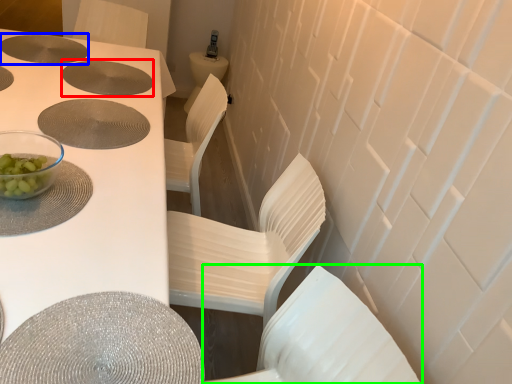
Question: Which object is positioned farthest from hole (highlighted by a red box)? Select from hole (highlighted by a blue box) and chair (highlighted by a green box).

Choices:
 (A) hole
 (B) chair

Answer: (B)